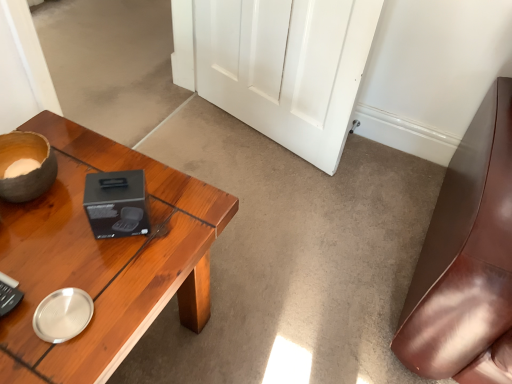
I want to click on free space above wooden desk at left (from a real-world perspective), so click(81, 243).